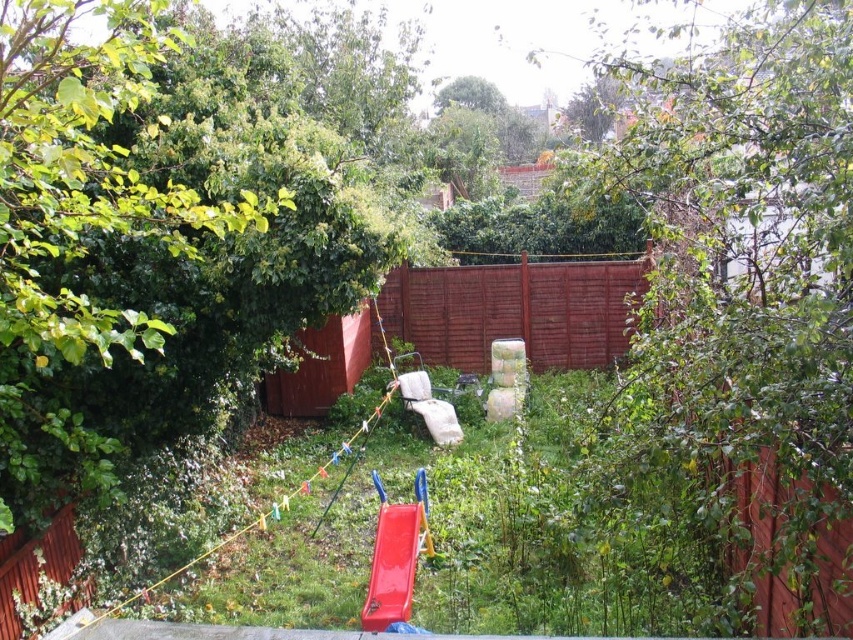
Can you confirm if brown wooden fence at center is thinner than shiny plastic slide at center?

In fact, brown wooden fence at center might be wider than shiny plastic slide at center.

Is point (403, 337) less distant than point (405, 532)?

No, it is behind (405, 532).

Is point (511, 314) positioned behind point (380, 593)?

Yes, it is.

Find the location of a particular element. The width and height of the screenshot is (853, 640). brown wooden fence at center is located at coordinates (514, 310).

This screenshot has height=640, width=853. What do you see at coordinates (486, 538) in the screenshot?
I see `green grass at center` at bounding box center [486, 538].

Between green grass at center and shiny plastic slide at center, which one has more height?

With more height is shiny plastic slide at center.

Which is in front, point (618, 602) or point (395, 566)?

Point (618, 602) is more forward.

This screenshot has width=853, height=640. What are the coordinates of `green grass at center` in the screenshot? It's located at (486, 538).

Who is shorter, green grass at center or brown wooden fence at center?

With less height is green grass at center.

Can you confirm if green grass at center is shorter than brown wooden fence at center?

Indeed, green grass at center has a lesser height compared to brown wooden fence at center.

Is point (404, 432) behind point (512, 323)?

No.

In order to click on green grass at center in this screenshot , I will do `click(486, 538)`.